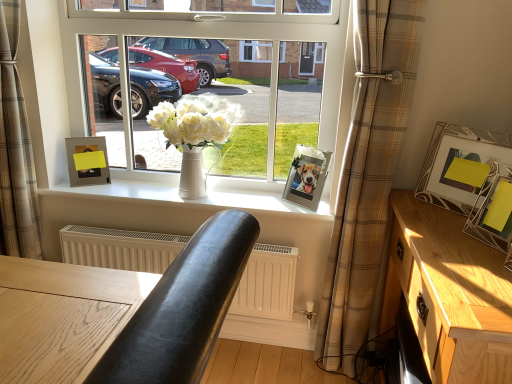
Find the location of `vacant space to the left of white ceramic vase at center`. vacant space to the left of white ceramic vase at center is located at coordinates (128, 191).